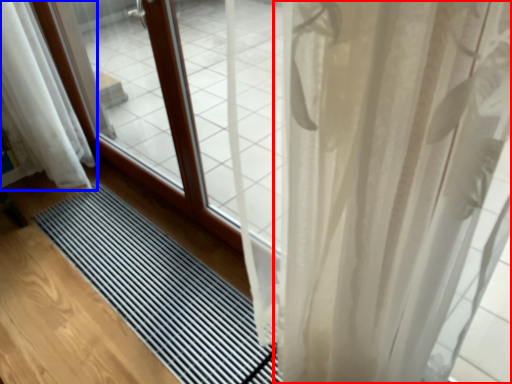
Question: Which of the following is the closest to the observer, curtain (highlighted by a red box) or curtain (highlighted by a blue box)?

Choices:
 (A) curtain
 (B) curtain

Answer: (A)